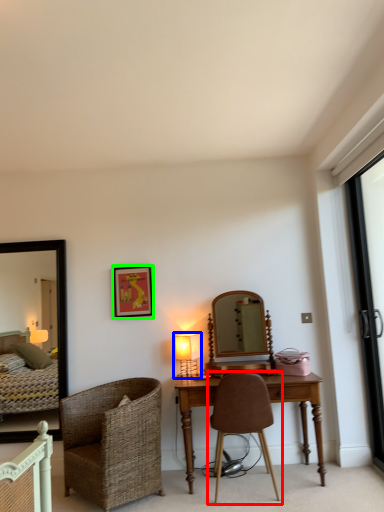
Question: Which object is the farthest from chair (highlighted by a red box)? Choose among these: table lamp (highlighted by a blue box) or picture frame (highlighted by a green box).

Choices:
 (A) table lamp
 (B) picture frame

Answer: (B)